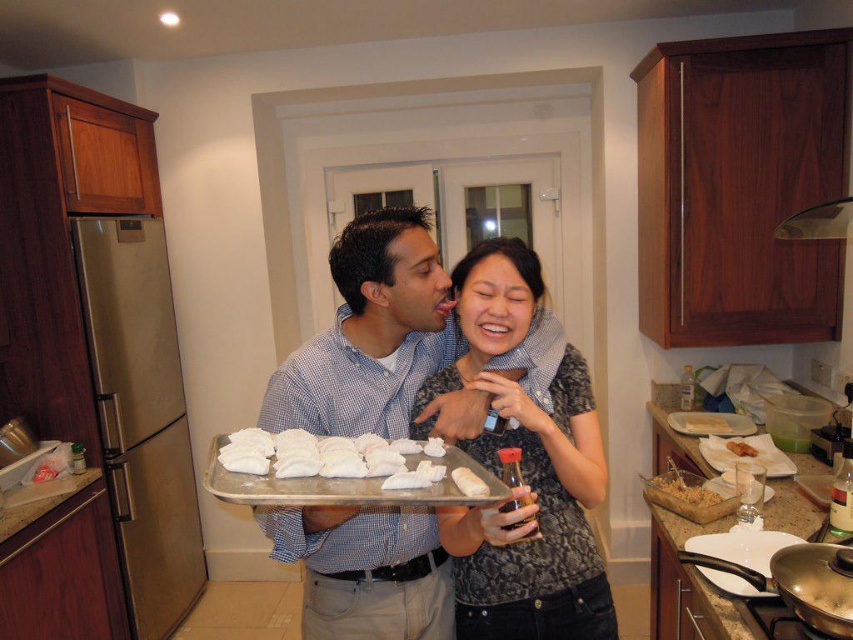
You are a chef in a busy kitchen. You need to place both the white matte tray at center and the yellow cardboard box at center on a shelf that can only hold items up to 30 cm in height. The shelf is currently empty. Can both items fit on the shelf based on their heights?

The white matte tray at center is much taller than the yellow cardboard box at center. Since the shelf has a height limit of 30 cm, both items can only fit if the taller item, the white matte tray at center, is under 30 cm. Without specific measurements, we cannot confirm if they fit, but the yellow cardboard box at center is shorter and likely under 30 cm if the tray is taller but still within the limit.

You are a food critic standing in the kitchen and see both the brown crispy chicken at center and the white fluffy pastry at center. Which one is positioned to the right side of the other?

The brown crispy chicken at center is positioned to the right of the white fluffy pastry at center.